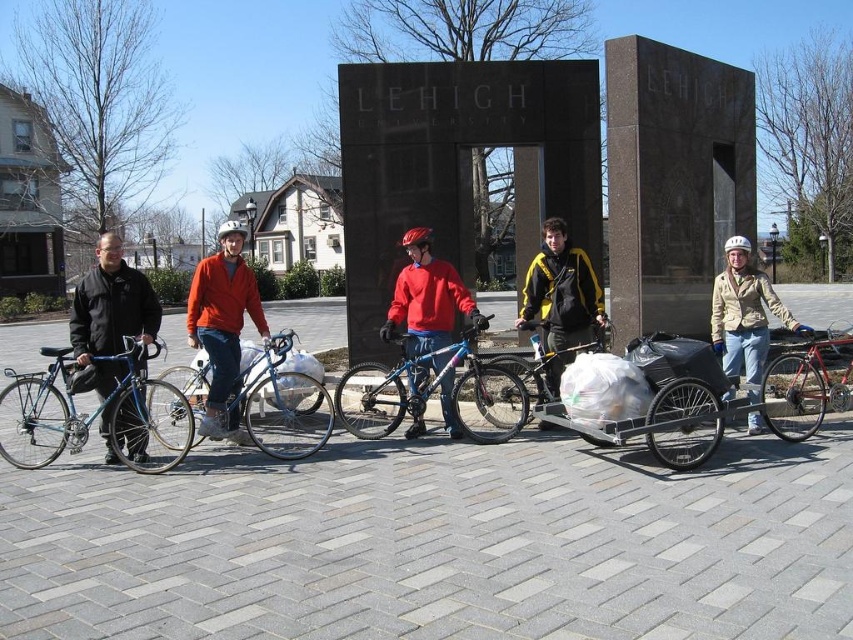
Does point (360, 433) come farther from viewer compared to point (735, 337)?

Yes, point (360, 433) is behind point (735, 337).

In order to click on blue metallic bicycle at center in this screenshot , I will do `click(432, 390)`.

Who is more distant from viewer, (265, 346) or (729, 312)?

Point (729, 312)

Is point (173, 371) positioned in front of point (792, 328)?

No, it is behind (792, 328).

The image size is (853, 640). Identify the location of shiny blue bicycle at center. (280, 401).

Between shiny blue bicycle at left and orange fabric jacket at center, which one is positioned lower?

shiny blue bicycle at left is below.

Is shiny blue bicycle at left below orange fabric jacket at center?

Yes, shiny blue bicycle at left is below orange fabric jacket at center.

Does point (180, 449) come closer to viewer compared to point (190, 291)?

No, it is not.

Find the location of `shiny blue bicycle at left`. shiny blue bicycle at left is located at coordinates (91, 412).